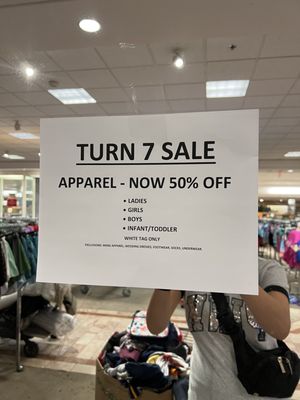
This screenshot has height=400, width=300. I want to click on ceiling lights, so click(x=68, y=92), click(x=219, y=83), click(x=296, y=154), click(x=84, y=23), click(x=27, y=73), click(x=180, y=63), click(x=24, y=135).